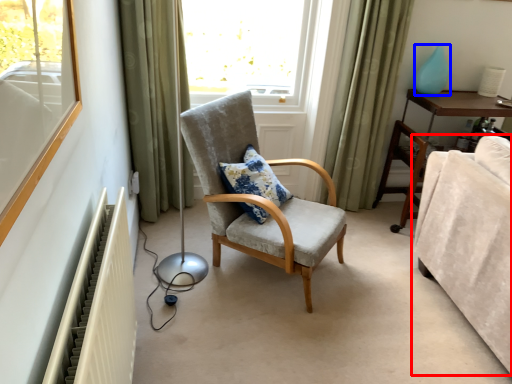
Question: Which object is closer to the camera taking this photo, studio couch (highlighted by a red box) or teal (highlighted by a blue box)?

Choices:
 (A) studio couch
 (B) teal

Answer: (A)